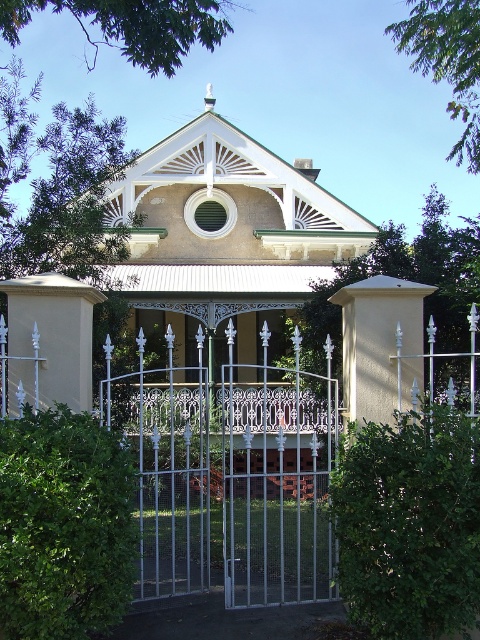
You are a delivery person with a large box that is 1.2 meters wide. You need to pass through either the white wrought iron gate at center or the green leafy hedge at lower left. Based on their widths, which path should you choose to ensure your box can fit through?

The white wrought iron gate at center might be wider than green leafy hedge at lower left, so you should choose the white wrought iron gate at center to ensure your box can fit through.

You are a delivery person approaching the house and need to determine the best path to the front door. The house has a white wrought iron gate at center and a green leafy hedge at right. Which object is taller and thus might block your view of the front door?

The white wrought iron gate at center is much taller than the green leafy hedge at right, so it might block your view of the front door.

Based on the photo, you are standing in front of the historic house and want to enter through the gate. Which object, the white wrought iron gate at center or the green leafy hedge at lower left, is closer to you as you face the house?

The white wrought iron gate at center is closer to you because it is located below the green leafy hedge at lower left, meaning it is positioned in front of the hedge from your perspective.